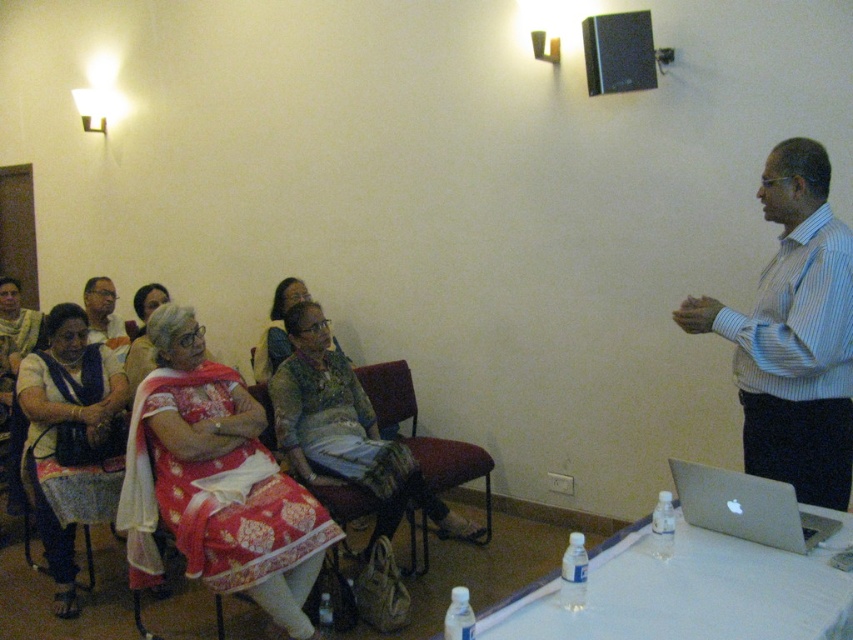
Question: Does red silk saree at center left lie in front of black plastic speaker at upper center?

Choices:
 (A) yes
 (B) no

Answer: (A)

Question: Which is farther from the silver metallic laptop at lower right?

Choices:
 (A) black plastic speaker at upper center
 (B) white plastic table at lower right

Answer: (A)

Question: Which point is closer to the camera?

Choices:
 (A) velvet-like fabric chair at center
 (B) blue striped shirt at upper right
 (C) textured beige dress at center
 (D) silver metallic laptop at lower right

Answer: (D)

Question: Is textured beige dress at center below matte green dress at center?

Choices:
 (A) no
 (B) yes

Answer: (B)

Question: Where is red silk saree at center left located in relation to matte white saree at center left in the image?

Choices:
 (A) right
 (B) left

Answer: (A)

Question: Which point appears closest to the camera in this image?

Choices:
 (A) (607, 72)
 (B) (393, 388)

Answer: (A)